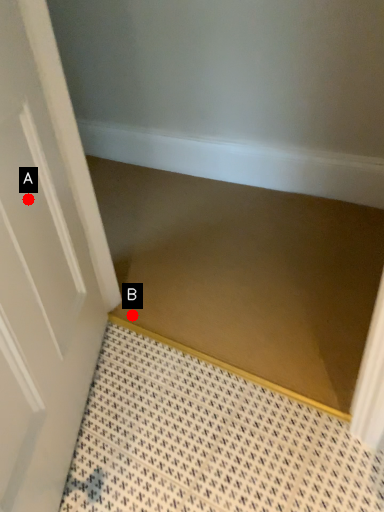
Question: Two points are circled on the image, labeled by A and B beside each circle. Which point is further to the camera?

Choices:
 (A) A is further
 (B) B is further

Answer: (B)